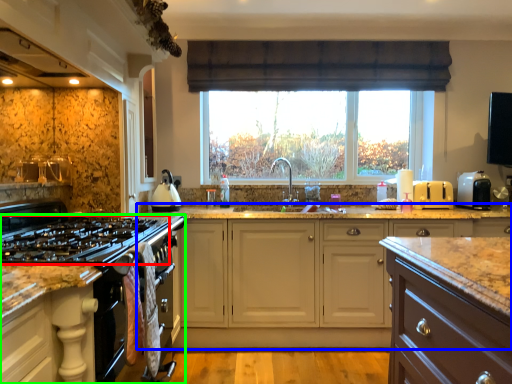
Question: Which is farther away from gas stove (highlighted by a red box)? cabinetry (highlighted by a blue box) or cabinetry (highlighted by a green box)?

Choices:
 (A) cabinetry
 (B) cabinetry

Answer: (A)